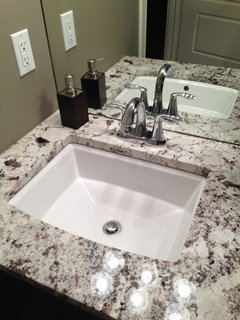
Find the location of a particular element. reflection of door is located at coordinates (209, 27).